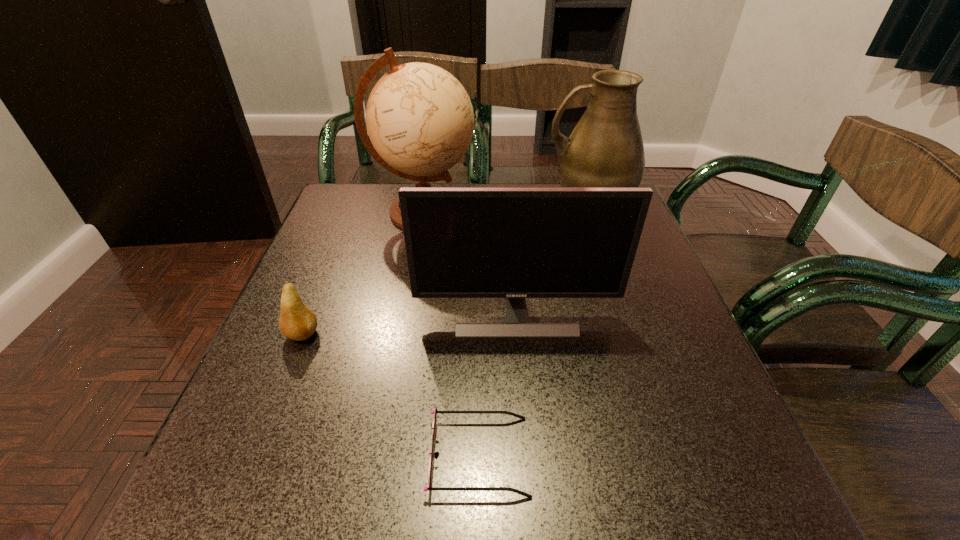
You are a GUI agent. You are given a task and a screenshot of the screen. Output one action in this format:
    pyautogui.click(x=<x>, y=<y>)
    Task: Click on the vacant area situated 0.270m on the handle side of the pitcher
    This screenshot has height=540, width=960.
    Given the screenshot: What is the action you would take?
    pyautogui.click(x=444, y=206)

In order to click on free spot located on the screen side of the third shortest object in this screenshot , I will do `click(527, 450)`.

This screenshot has height=540, width=960. In order to click on free spot located on the back of the leftmost object in this screenshot , I will do `click(319, 294)`.

At what (x,y) coordinates should I click in order to perform the action: click on vacant space positioned on the bridge of the nearest object. Please return your answer as a coordinate pair (x, y). Looking at the image, I should click on (627, 456).

This screenshot has width=960, height=540. What are the coordinates of `globe that is positioned at the far edge` in the screenshot? It's located at (420, 120).

Image resolution: width=960 pixels, height=540 pixels. Identify the location of pitcher that is at the far edge. (605, 149).

You are a GUI agent. You are given a task and a screenshot of the screen. Output one action in this format:
    pyautogui.click(x=<x>, y=<y>)
    Task: Click on the object located at the near edge
    
    Given the screenshot: What is the action you would take?
    pyautogui.click(x=435, y=412)

You are a GUI agent. You are given a task and a screenshot of the screen. Output one action in this format:
    pyautogui.click(x=<x>, y=<y>)
    Task: Click on the globe positioned at the left edge
    The width and height of the screenshot is (960, 540).
    Given the screenshot: What is the action you would take?
    (420, 120)

Locate an element on the screen. This screenshot has width=960, height=540. pear located in the left edge section of the desktop is located at coordinates (297, 322).

Image resolution: width=960 pixels, height=540 pixels. What are the coordinates of `pitcher situated at the right edge` in the screenshot? It's located at (605, 149).